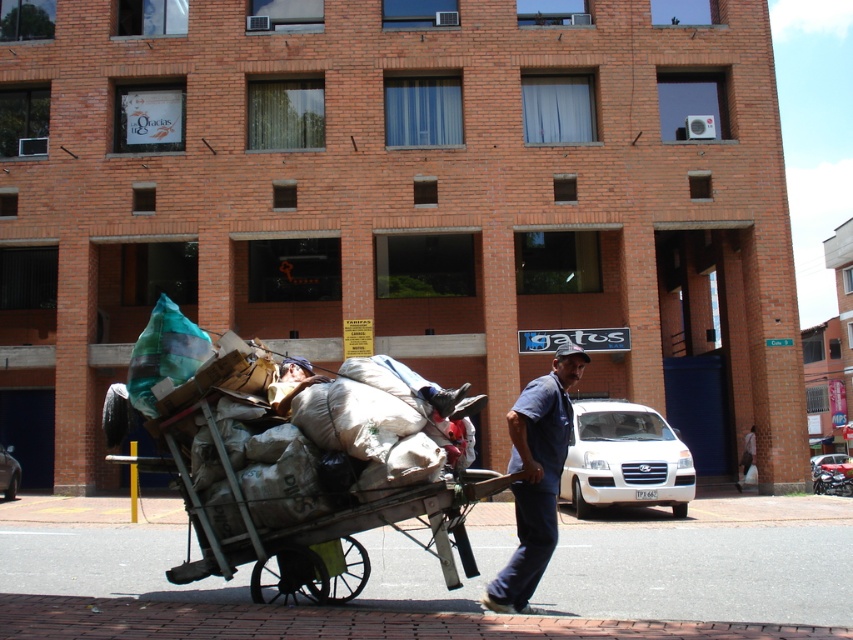
Question: Observing the image, what is the correct spatial positioning of wooden cart at center in reference to blue denim shirt at center?

Choices:
 (A) left
 (B) right

Answer: (A)

Question: Among these points, which one is farthest from the camera?

Choices:
 (A) (524, 598)
 (B) (363, 506)

Answer: (A)

Question: Which of the following is the farthest from the observer?

Choices:
 (A) blue denim shirt at center
 (B) wooden cart at center

Answer: (A)

Question: Does wooden cart at center have a larger size compared to blue denim shirt at center?

Choices:
 (A) yes
 (B) no

Answer: (A)

Question: Can you confirm if wooden cart at center is positioned below blue denim shirt at center?

Choices:
 (A) no
 (B) yes

Answer: (B)